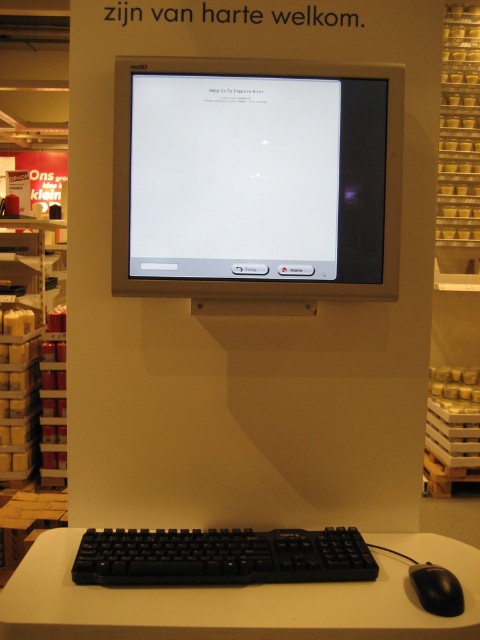
Question: Where is matte silver monitor at center located in relation to white plastic table at center in the image?

Choices:
 (A) above
 (B) below

Answer: (A)

Question: Which object is positioned closest to the black plastic keyboard at lower center?

Choices:
 (A) white plastic table at center
 (B) black matte mouse at lower right
 (C) matte silver monitor at center

Answer: (A)

Question: Is matte silver monitor at center behind black matte mouse at lower right?

Choices:
 (A) no
 (B) yes

Answer: (B)

Question: Where is white plastic table at center located in relation to black matte mouse at lower right in the image?

Choices:
 (A) above
 (B) below

Answer: (B)

Question: Which point is farther to the camera?

Choices:
 (A) matte silver monitor at center
 (B) black matte mouse at lower right

Answer: (A)

Question: Which point is farther to the camera?

Choices:
 (A) (410, 580)
 (B) (208, 218)
 (C) (319, 570)
 (D) (206, 588)

Answer: (B)